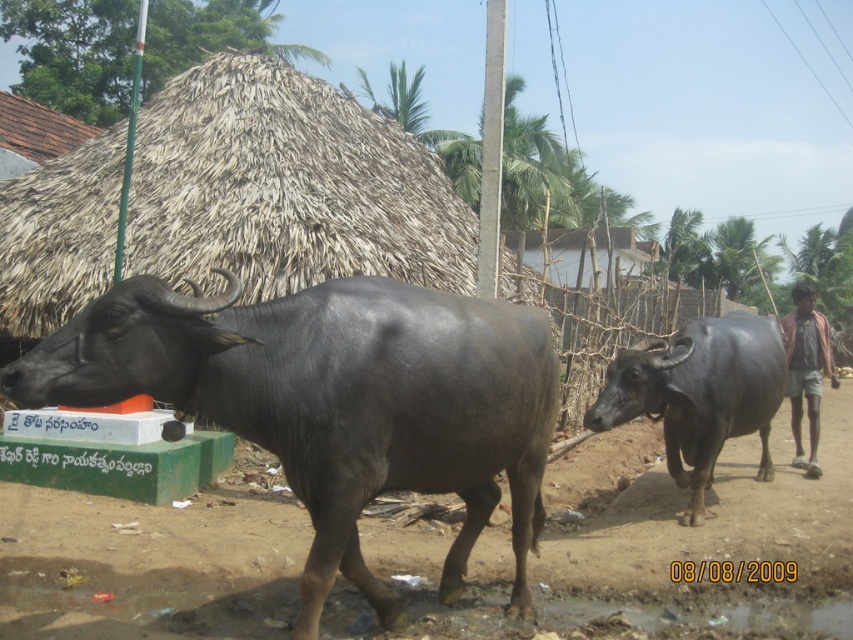
You are a farmer standing on the dirt path and want to cross to the other side. There are two bulls blocking your way. The black glossy bull at left and the shiny black bull at center. Which bull should you move first to get through?

The black glossy bull at left is positioned over shiny black bull at center, so you should move the black glossy bull at left first to get through.